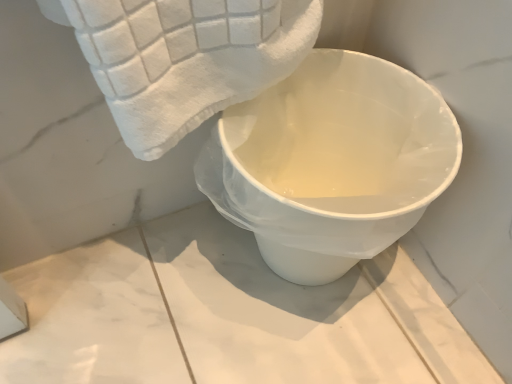
Question: Considering their positions, is white glossy toilet at center located in front of or behind white soft towel at upper left?

Choices:
 (A) behind
 (B) front

Answer: (A)

Question: From the image's perspective, is white glossy toilet at center above or below white soft towel at upper left?

Choices:
 (A) above
 (B) below

Answer: (B)

Question: Is white glossy toilet at center inside the boundaries of white soft towel at upper left, or outside?

Choices:
 (A) inside
 (B) outside

Answer: (B)

Question: From the image's perspective, relative to white glossy toilet at center, is white soft towel at upper left above or below?

Choices:
 (A) below
 (B) above

Answer: (B)

Question: In terms of height, does white soft towel at upper left look taller or shorter compared to white glossy toilet at center?

Choices:
 (A) tall
 (B) short

Answer: (B)

Question: Is white soft towel at upper left inside the boundaries of white glossy toilet at center, or outside?

Choices:
 (A) outside
 (B) inside

Answer: (A)

Question: Looking at their shapes, would you say white soft towel at upper left is wider or thinner than white glossy toilet at center?

Choices:
 (A) wide
 (B) thin

Answer: (B)